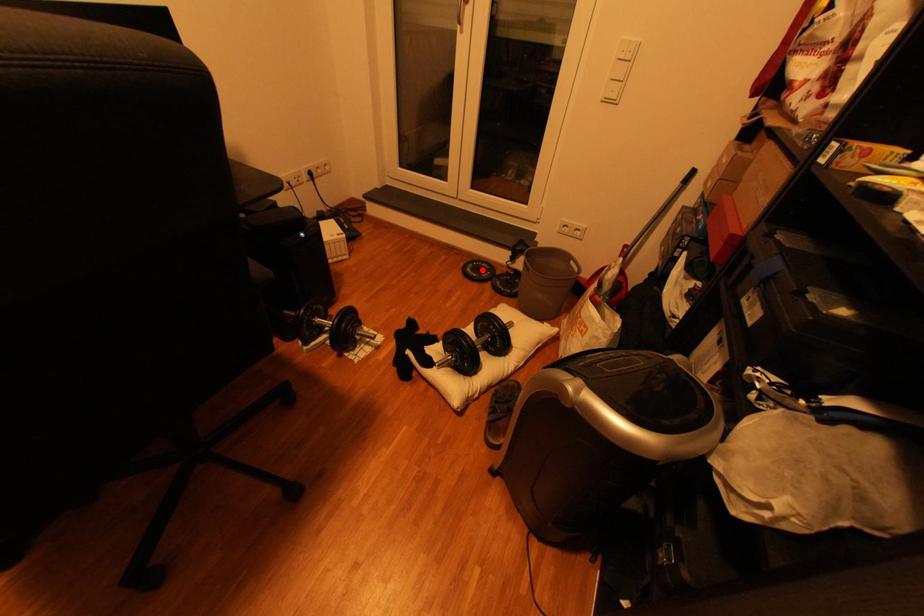
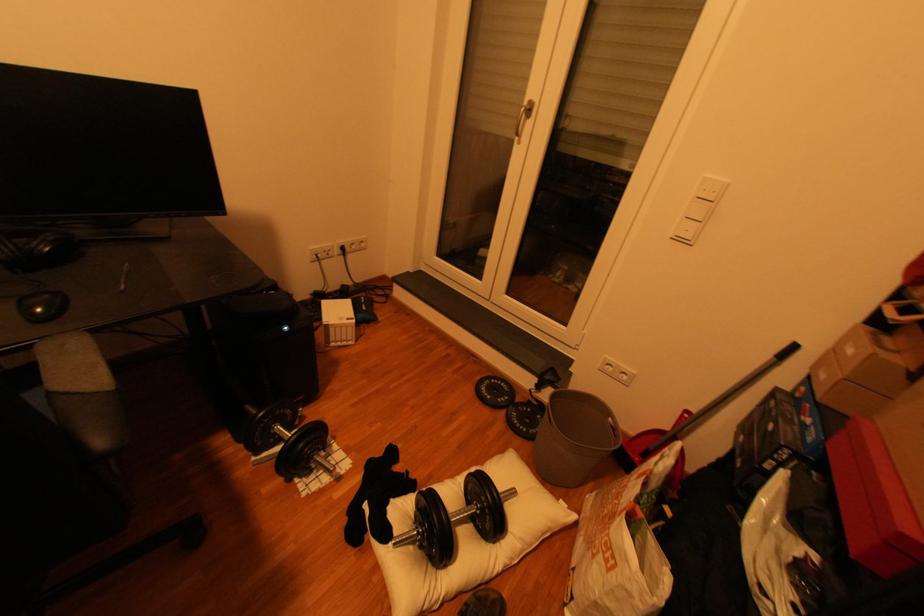
Question: A red point is marked in image1. In image2, is the corresponding 3D point closer to the camera or farther? Reply with the corresponding letter.

Choices:
 (A) The corresponding 3D point is closer.
 (B) The corresponding 3D point is farther.

Answer: (A)